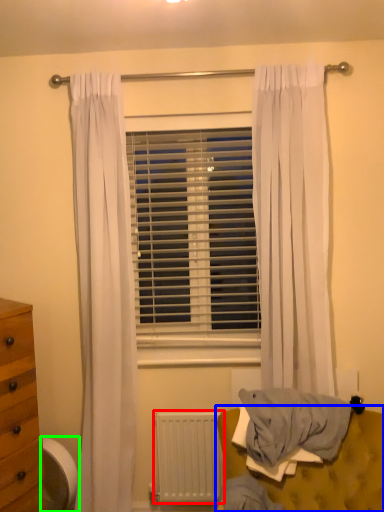
Question: Which object is the farthest from radiator (highlighted by a red box)? Choose among these: furniture (highlighted by a blue box) or swivel chair (highlighted by a green box).

Choices:
 (A) furniture
 (B) swivel chair

Answer: (B)